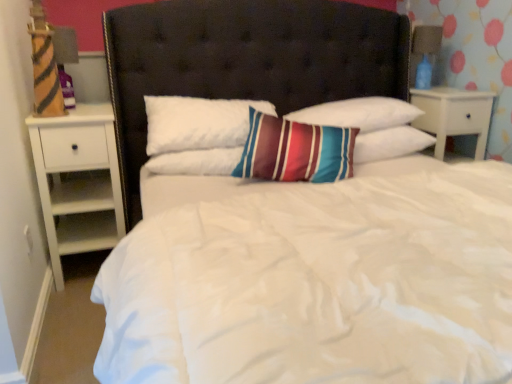
Question: Is white soft pillow at center, which appears as the 3th pillow when viewed from the right, further to camera compared to blue glass lamp at upper right?

Choices:
 (A) yes
 (B) no

Answer: (B)

Question: From the image's perspective, is white soft pillow at center, which appears as the 3th pillow when viewed from the right, under blue glass lamp at upper right?

Choices:
 (A) no
 (B) yes

Answer: (B)

Question: Is white soft pillow at center, the first pillow in the left-to-right sequence, smaller than blue glass lamp at upper right?

Choices:
 (A) no
 (B) yes

Answer: (A)

Question: Is white soft pillow at center, which appears as the 3th pillow when viewed from the right, placed right next to blue glass lamp at upper right?

Choices:
 (A) no
 (B) yes

Answer: (A)

Question: Can you confirm if white soft pillow at center, which appears as the 3th pillow when viewed from the right, is positioned to the right of blue glass lamp at upper right?

Choices:
 (A) yes
 (B) no

Answer: (B)

Question: Is white wood nightstand at right, which is counted as the 1th nightstand, starting from the right, wider or thinner than blue glass lamp at upper right?

Choices:
 (A) thin
 (B) wide

Answer: (B)

Question: Considering the positions of white wood nightstand at right, which appears as the 2th nightstand when viewed from the left, and blue glass lamp at upper right in the image, is white wood nightstand at right, which appears as the 2th nightstand when viewed from the left, bigger or smaller than blue glass lamp at upper right?

Choices:
 (A) big
 (B) small

Answer: (A)

Question: Is white wood nightstand at right, which appears as the 2th nightstand when viewed from the left, taller or shorter than blue glass lamp at upper right?

Choices:
 (A) short
 (B) tall

Answer: (B)

Question: Choose the correct answer: Is white wood nightstand at right, which appears as the 2th nightstand when viewed from the left, inside blue glass lamp at upper right or outside it?

Choices:
 (A) inside
 (B) outside

Answer: (B)

Question: Considering the relative positions of white soft pillow at center, which appears as the 3th pillow when viewed from the right, and white wood nightstand at left, positioned as the 1th nightstand in left-to-right order, in the image provided, is white soft pillow at center, which appears as the 3th pillow when viewed from the right, to the left or to the right of white wood nightstand at left, positioned as the 1th nightstand in left-to-right order,?

Choices:
 (A) left
 (B) right

Answer: (B)

Question: In the image, is white soft pillow at center, which appears as the 3th pillow when viewed from the right, positioned in front of or behind white wood nightstand at left, positioned as the 1th nightstand in left-to-right order?

Choices:
 (A) front
 (B) behind

Answer: (B)

Question: Considering the positions of white soft pillow at center, which appears as the 3th pillow when viewed from the right, and white wood nightstand at left, positioned as the 1th nightstand in left-to-right order, in the image, is white soft pillow at center, which appears as the 3th pillow when viewed from the right, wider or thinner than white wood nightstand at left, positioned as the 1th nightstand in left-to-right order,?

Choices:
 (A) wide
 (B) thin

Answer: (B)

Question: Is white soft pillow at center, the first pillow in the left-to-right sequence, spatially inside white wood nightstand at left, positioned as the 1th nightstand in left-to-right order, or outside of it?

Choices:
 (A) outside
 (B) inside

Answer: (A)

Question: From a real-world perspective, is striped cotton pillow at center, the third pillow when ordered from left to right, above or below white wood nightstand at left, which ranks as the second nightstand in right-to-left order?

Choices:
 (A) below
 (B) above

Answer: (B)

Question: Is point pyautogui.click(x=411, y=145) positioned closer to the camera than point pyautogui.click(x=114, y=190)?

Choices:
 (A) closer
 (B) farther

Answer: (B)